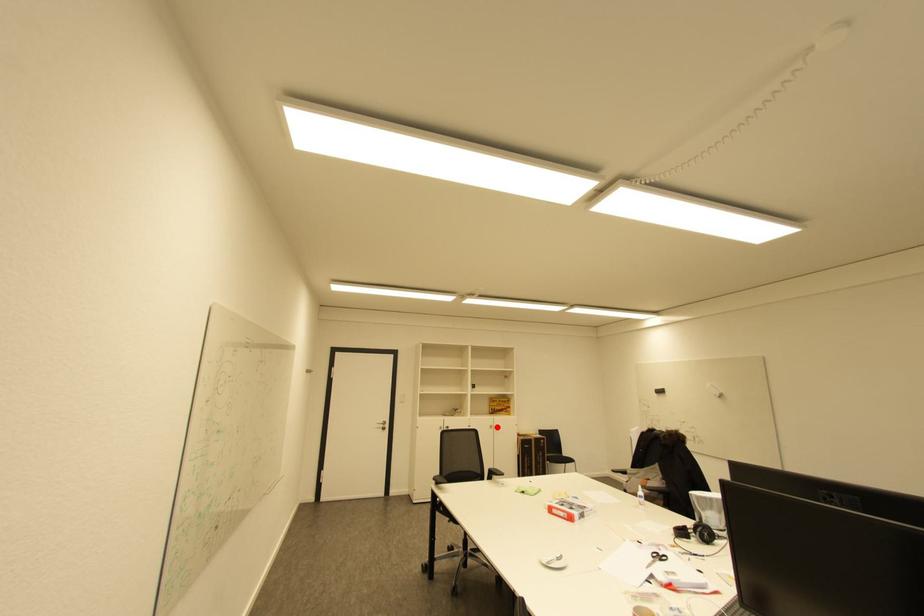
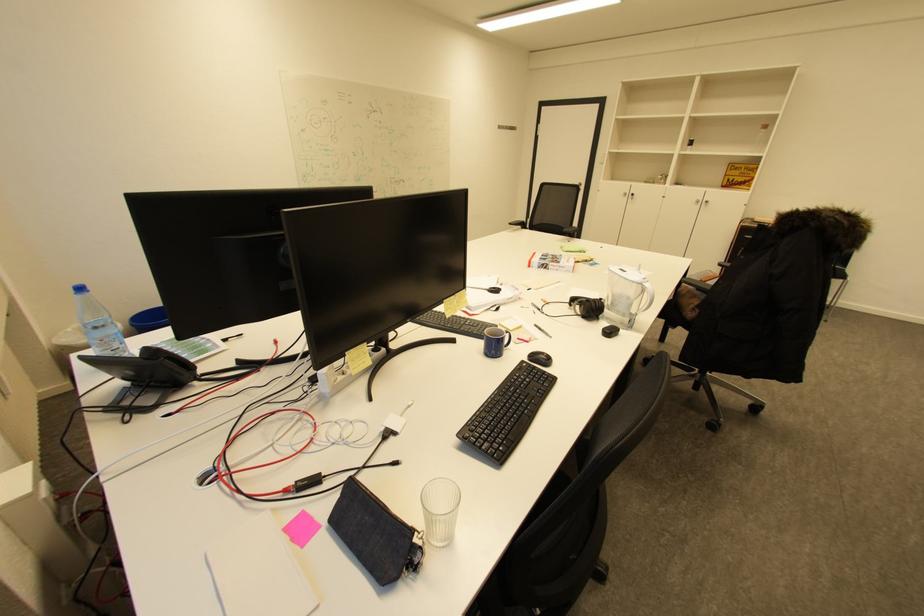
Question: I am providing you with two images of the same scene from different viewpoints. Given a red point in image1, look at the same physical point in image2. Is it:

Choices:
 (A) Closer to the viewpoint
 (B) Farther from the viewpoint

Answer: (A)